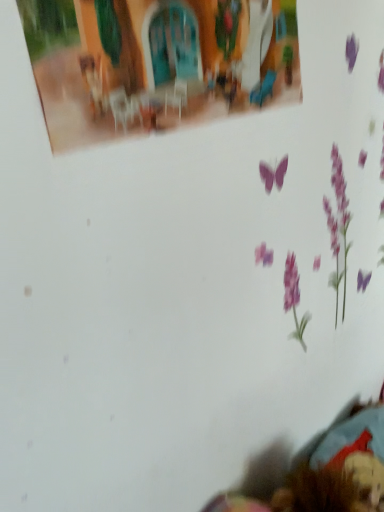
Describe the element at coordinates (157, 63) in the screenshot. Image resolution: width=384 pixels, height=512 pixels. I see `matte plastic picture frame at upper left` at that location.

Where is `matte plastic picture frame at upper left`? matte plastic picture frame at upper left is located at coordinates (157, 63).

In order to click on matte plastic picture frame at upper left in this screenshot , I will do `click(157, 63)`.